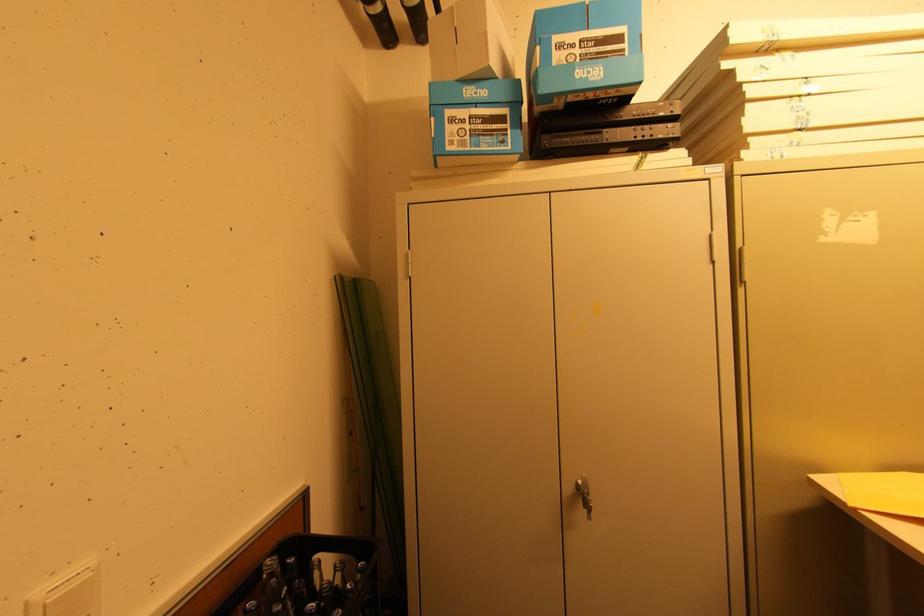
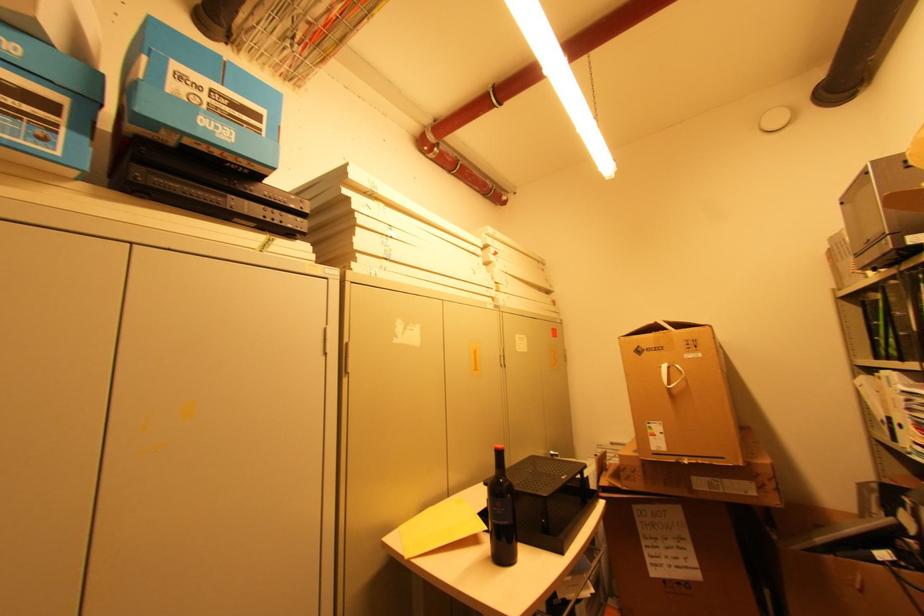
In the second image, find the point that corresponds to (603,71) in the first image.

(235, 134)